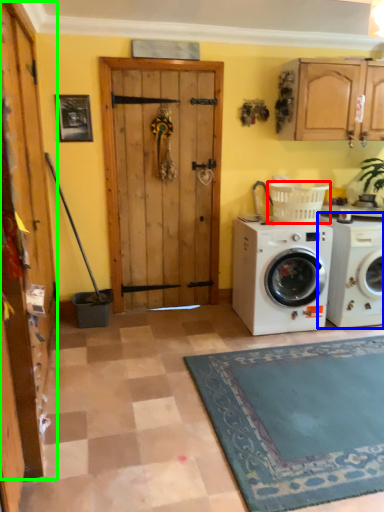
Question: Based on their relative distances, which object is nearer to laundry basket (highlighted by a red box)? Choose from washing machine (highlighted by a blue box) and barn door (highlighted by a green box).

Choices:
 (A) washing machine
 (B) barn door

Answer: (A)